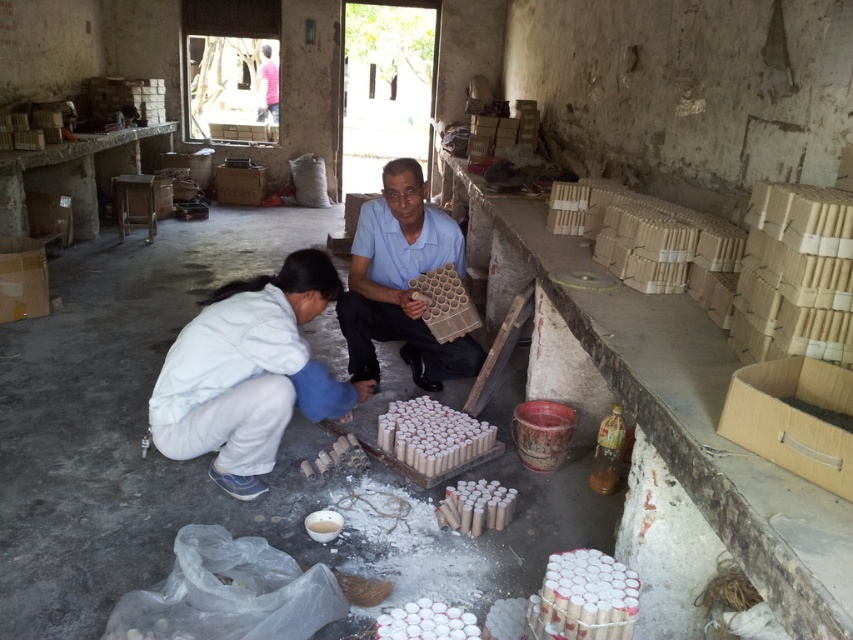
From the picture: Is the position of white matte jacket at lower left more distant than that of matte cardboard tray at center?

No, white matte jacket at lower left is in front of matte cardboard tray at center.

Where is `white matte jacket at lower left`? This screenshot has height=640, width=853. white matte jacket at lower left is located at coordinates (248, 372).

Which is in front, point (225, 460) or point (440, 353)?

Point (225, 460) is in front.

Image resolution: width=853 pixels, height=640 pixels. Find the location of `white matte jacket at lower left`. white matte jacket at lower left is located at coordinates (248, 372).

Who is positioned more to the left, matte cardboard tray at center or white matte egg at center?

Positioned to the left is matte cardboard tray at center.

Can you confirm if matte cardboard tray at center is positioned below white matte egg at center?

Actually, matte cardboard tray at center is above white matte egg at center.

The image size is (853, 640). What do you see at coordinates (401, 282) in the screenshot?
I see `matte cardboard tray at center` at bounding box center [401, 282].

Where is `matte cardboard tray at center`? Image resolution: width=853 pixels, height=640 pixels. matte cardboard tray at center is located at coordinates (401, 282).

Is white matte cylinder at center smaller than white matte egg at center?

Actually, white matte cylinder at center might be larger than white matte egg at center.

Does white matte cylinder at center appear over white matte egg at center?

Yes.

Is point (404, 448) behind point (465, 637)?

Yes, point (404, 448) is behind point (465, 637).

Find the location of a particular element. white matte cylinder at center is located at coordinates (431, 435).